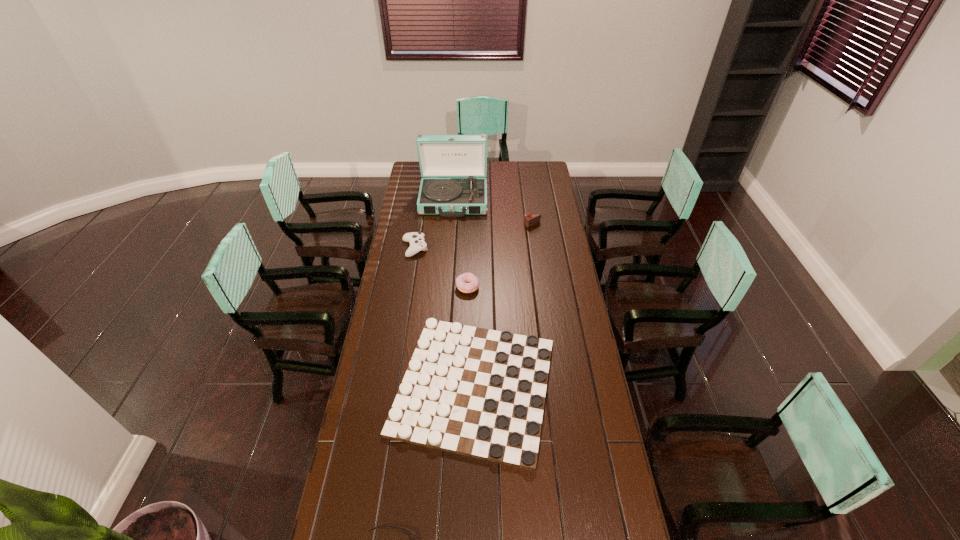
At what (x,y) coordinates should I click in order to perform the action: click on the farthest object. Please return your answer as a coordinate pair (x, y). Image resolution: width=960 pixels, height=540 pixels. Looking at the image, I should click on (439, 155).

Image resolution: width=960 pixels, height=540 pixels. I want to click on record player, so click(x=439, y=155).

This screenshot has height=540, width=960. Find the location of `chocolate cake`. chocolate cake is located at coordinates (530, 219).

You are a GUI agent. You are given a task and a screenshot of the screen. Output one action in this format:
    pyautogui.click(x=<x>, y=<y>)
    Task: Click on the third farthest object
    Image resolution: width=960 pixels, height=540 pixels.
    Given the screenshot: What is the action you would take?
    pyautogui.click(x=416, y=239)

Image resolution: width=960 pixels, height=540 pixels. Identify the location of doughnut. (473, 283).

In order to click on gameboard in this screenshot , I will do `click(477, 392)`.

At what (x,y) coordinates should I click in order to perform the action: click on the shortest object. Please return your answer as a coordinate pair (x, y). The height and width of the screenshot is (540, 960). Looking at the image, I should click on (477, 392).

This screenshot has height=540, width=960. What are the coordinates of `vacant space located on the face side of the farthest object` in the screenshot? It's located at pos(449,252).

I want to click on free region located on the back of the fifth nearest object, so click(531, 213).

Locate an element on the screen. blank area located on the right of the third farthest object is located at coordinates (468, 248).